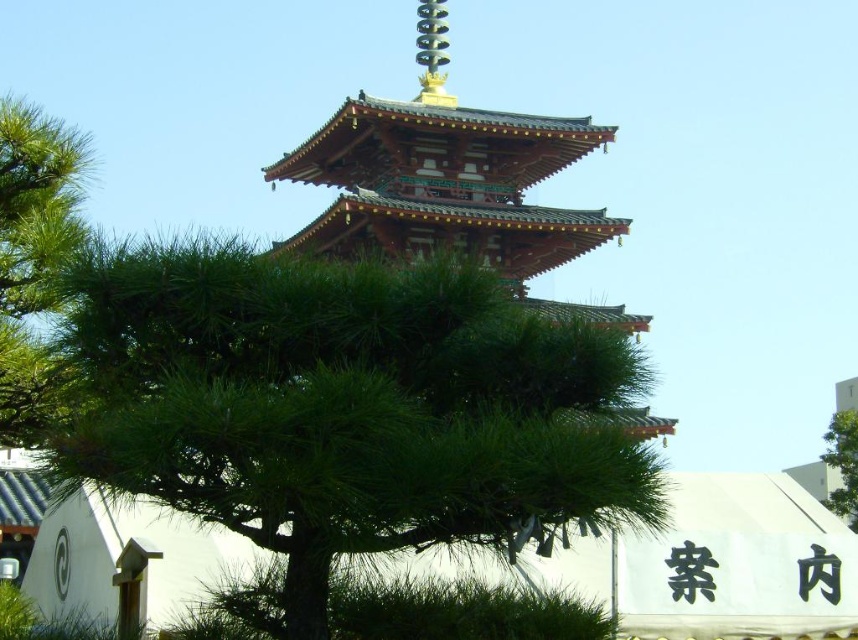
Is point (585, 364) closer to viewer compared to point (49, 148)?

That is True.

Can you confirm if green matte tree at center is shorter than green needle-like leaves at left?

Correct, green matte tree at center is not as tall as green needle-like leaves at left.

Between point (153, 314) and point (13, 390), which one is positioned in front?

Point (153, 314) is more forward.

The image size is (858, 640). I want to click on green matte tree at center, so click(x=343, y=404).

Does point (11, 227) lie in front of point (843, 424)?

Yes.

Does green needle-like leaves at left appear on the left side of green leafy tree at upper right?

Indeed, green needle-like leaves at left is positioned on the left side of green leafy tree at upper right.

Who is more distant from viewer, (37, 304) or (828, 452)?

The point (828, 452) is more distant.

Locate an element on the screen. green needle-like leaves at left is located at coordinates (32, 253).

From the picture: Is green matte tree at center further to the viewer compared to green leafy tree at upper right?

No.

Is green matte tree at center above green leafy tree at upper right?

Correct, green matte tree at center is located above green leafy tree at upper right.

Based on the photo, who is more forward, [80,406] or [829,454]?

Point [80,406] is more forward.

Locate an element on the screen. green matte tree at center is located at coordinates (343, 404).